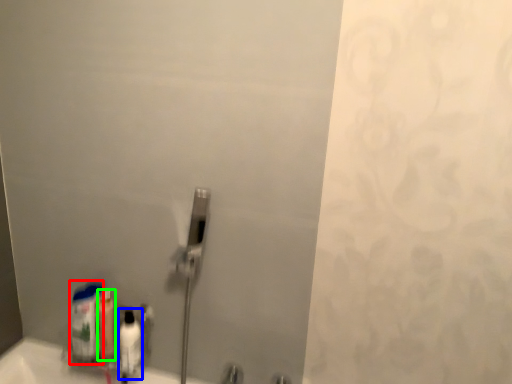
Question: Estimate the real-world distances between objects in this image. Which object is closer to cleaning product (highlighted by a red box), mouthwash (highlighted by a blue box) or mouthwash (highlighted by a green box)?

Choices:
 (A) mouthwash
 (B) mouthwash

Answer: (B)